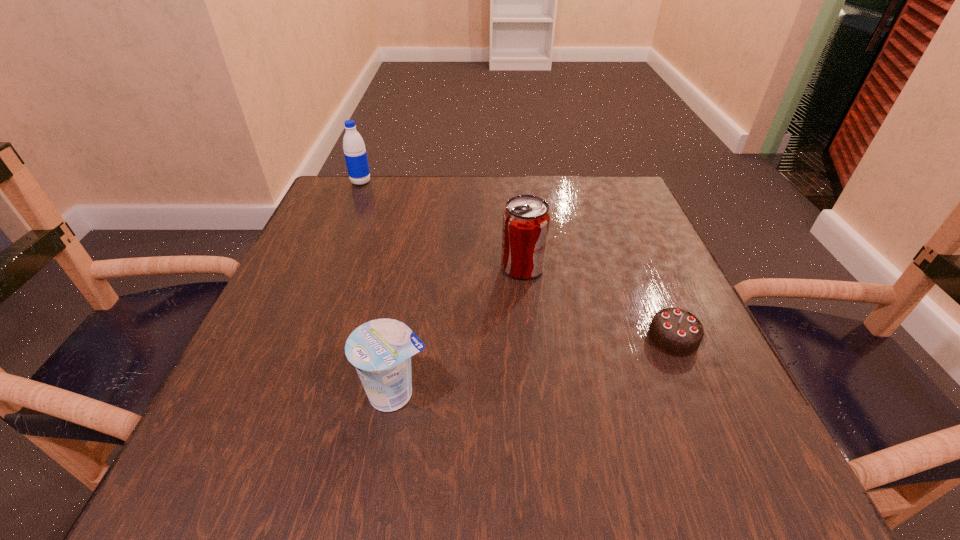
Identify the location of the leftmost object. The width and height of the screenshot is (960, 540). (355, 153).

This screenshot has height=540, width=960. Find the location of `the farthest object`. the farthest object is located at coordinates (355, 153).

Where is `pop soda`? The width and height of the screenshot is (960, 540). pop soda is located at coordinates (526, 220).

The width and height of the screenshot is (960, 540). In order to click on the third object from left to right in this screenshot , I will do `click(526, 220)`.

Locate an element on the screen. This screenshot has height=540, width=960. yogurt is located at coordinates (381, 349).

Where is `the second shortest object`? Image resolution: width=960 pixels, height=540 pixels. the second shortest object is located at coordinates (381, 349).

This screenshot has height=540, width=960. I want to click on the shortest object, so click(674, 331).

What are the coordinates of `the second nearest object` in the screenshot? It's located at (674, 331).

You are a GUI agent. You are given a task and a screenshot of the screen. Output one action in this format:
    pyautogui.click(x=<x>, y=<y>)
    Task: Click on the vacant region located on the right of the leftmost object
    The image size is (960, 540).
    Given the screenshot: What is the action you would take?
    pyautogui.click(x=474, y=182)

Identify the location of free space located 0.150m on the right of the pop soda. (618, 267).